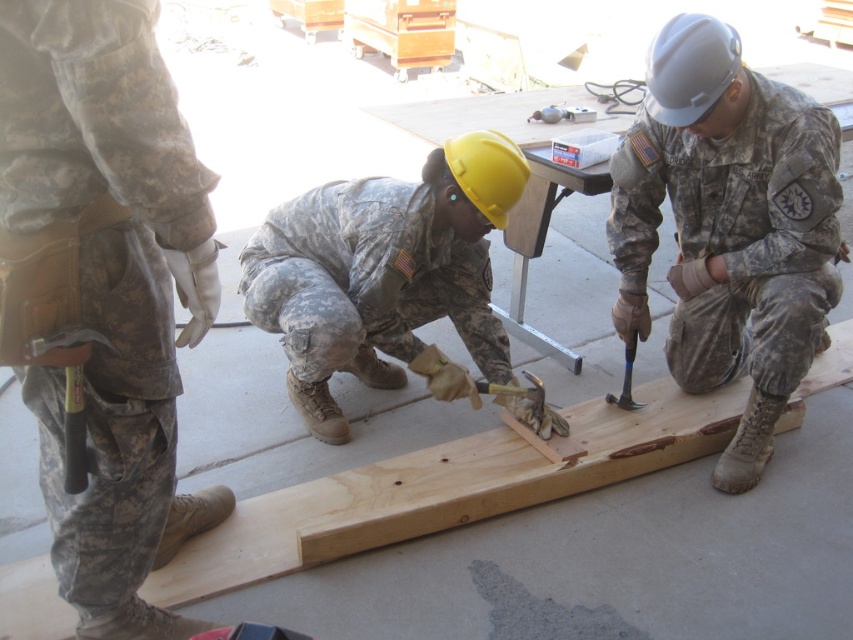
Question: Among these points, which one is farthest from the camera?

Choices:
 (A) (677, 355)
 (B) (361, 307)

Answer: (A)

Question: Considering the real-world distances, which object is farthest from the metallic silver hammer at center?

Choices:
 (A) camouflage fabric pants at center
 (B) matte gray helmet at center
 (C) yellow matte helmet at center

Answer: (A)

Question: Which point is closer to the camera?

Choices:
 (A) matte gray helmet at center
 (B) yellow matte helmet at center
 (C) camouflage fabric pants at center
 (D) metallic silver hammer at center

Answer: (C)

Question: Can you confirm if camouflage fabric pants at center is positioned below metallic silver hammer at center?

Choices:
 (A) no
 (B) yes

Answer: (B)

Question: Is matte gray helmet at center positioned at the back of metallic silver hammer at center?

Choices:
 (A) yes
 (B) no

Answer: (B)

Question: Observing the image, what is the correct spatial positioning of matte gray helmet at center in reference to yellow matte helmet at center?

Choices:
 (A) above
 (B) below

Answer: (A)